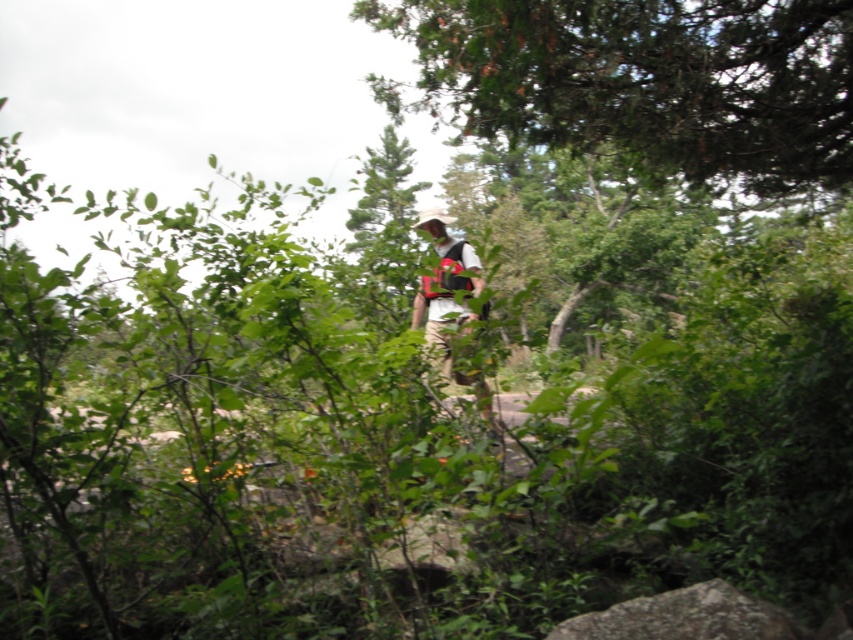
Question: Among these points, which one is nearest to the camera?

Choices:
 (A) (440, 240)
 (B) (563, 72)

Answer: (B)

Question: Can you confirm if green leafy tree at upper center is thinner than white cotton shirt at center?

Choices:
 (A) yes
 (B) no

Answer: (B)

Question: Does green leafy tree at upper center have a lesser width compared to white cotton shirt at center?

Choices:
 (A) no
 (B) yes

Answer: (A)

Question: From the image, what is the correct spatial relationship of green leafy tree at upper center in relation to white cotton shirt at center?

Choices:
 (A) above
 (B) below

Answer: (A)